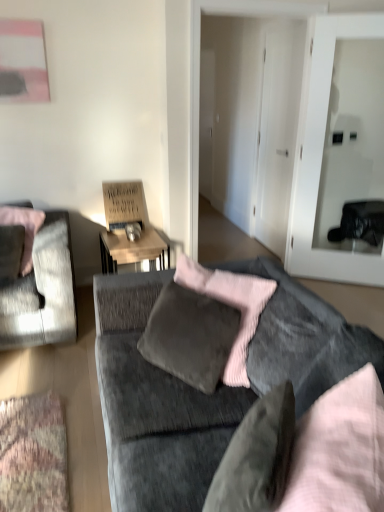
Question: From a real-world perspective, does velvet gray pillow at center, which is the 2th pillow in top-to-bottom order, stand above velvet grey chair at left?

Choices:
 (A) yes
 (B) no

Answer: (A)

Question: From the image's perspective, is velvet gray pillow at center, which is counted as the second pillow, starting from the left, on top of velvet grey chair at left?

Choices:
 (A) no
 (B) yes

Answer: (A)

Question: Is velvet gray pillow at center, which appears as the second pillow when viewed from the back, not close to velvet grey chair at left?

Choices:
 (A) no
 (B) yes

Answer: (B)

Question: Is velvet gray pillow at center, which is the 1th pillow in bottom-to-top order, to the right of velvet grey chair at left from the viewer's perspective?

Choices:
 (A) no
 (B) yes

Answer: (B)

Question: Is velvet gray pillow at center, which is the 1th pillow in bottom-to-top order, smaller than velvet grey chair at left?

Choices:
 (A) no
 (B) yes

Answer: (B)

Question: Relative to velvet grey chair at left, is transparent glass door at center right in front or behind?

Choices:
 (A) behind
 (B) front

Answer: (A)

Question: From their relative heights in the image, would you say transparent glass door at center right is taller or shorter than velvet grey chair at left?

Choices:
 (A) short
 (B) tall

Answer: (B)

Question: Is point (339, 274) positioned closer to the camera than point (61, 305)?

Choices:
 (A) closer
 (B) farther

Answer: (B)

Question: From a real-world perspective, is transparent glass door at center right positioned above or below velvet grey chair at left?

Choices:
 (A) above
 (B) below

Answer: (A)

Question: In terms of height, does wooden desk at center look taller or shorter compared to transparent glass door at center right?

Choices:
 (A) short
 (B) tall

Answer: (A)

Question: Relative to transparent glass door at center right, is wooden desk at center in front or behind?

Choices:
 (A) front
 (B) behind

Answer: (B)

Question: From the image's perspective, relative to transparent glass door at center right, is wooden desk at center above or below?

Choices:
 (A) below
 (B) above

Answer: (A)

Question: Does point (140, 238) appear closer or farther from the camera than point (311, 81)?

Choices:
 (A) closer
 (B) farther

Answer: (B)

Question: Is point (119, 281) positioned closer to the camera than point (243, 467)?

Choices:
 (A) closer
 (B) farther

Answer: (B)

Question: From a real-world perspective, is velvet gray couch at center above or below velvet gray pillow at center, acting as the first pillow starting from the right?

Choices:
 (A) above
 (B) below

Answer: (B)